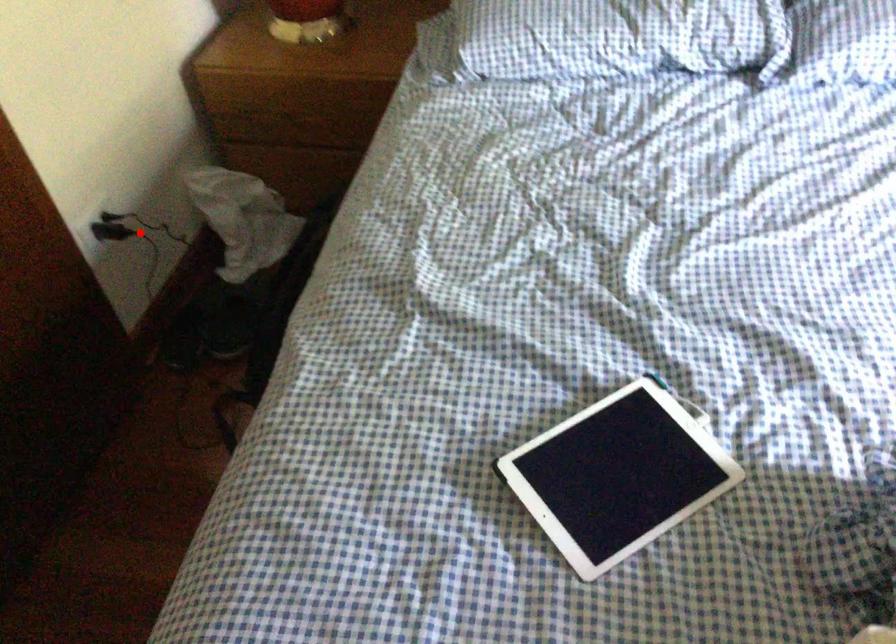
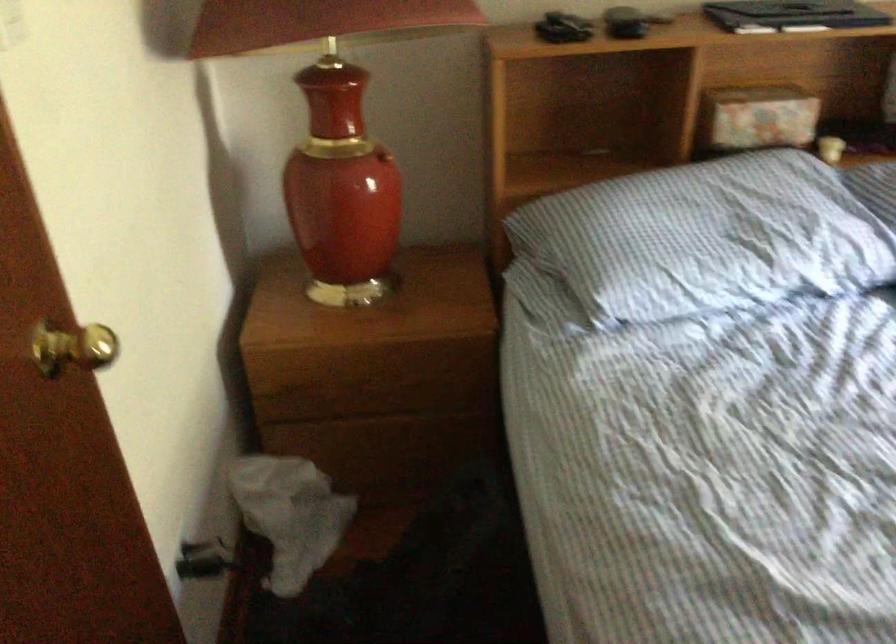
The point at the highlighted location is marked in the first image. Where is the corresponding point in the second image?

(204, 560)